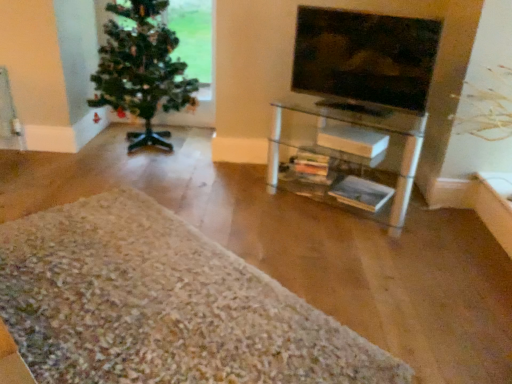
Question: Could you tell me if green matte christmas tree at left is facing matte glass tv at upper right?

Choices:
 (A) no
 (B) yes

Answer: (A)

Question: Is green matte christmas tree at left turned away from matte glass tv at upper right?

Choices:
 (A) yes
 (B) no

Answer: (B)

Question: From a real-world perspective, does green matte christmas tree at left stand above matte glass tv at upper right?

Choices:
 (A) no
 (B) yes

Answer: (A)

Question: Is green matte christmas tree at left smaller than matte glass tv at upper right?

Choices:
 (A) no
 (B) yes

Answer: (A)

Question: Is there a large distance between green matte christmas tree at left and matte glass tv at upper right?

Choices:
 (A) no
 (B) yes

Answer: (B)

Question: From the image's perspective, is white shaggy rug at lower left located above or below matte glass tv at upper right?

Choices:
 (A) above
 (B) below

Answer: (B)

Question: Is point (373, 354) closer or farther from the camera than point (426, 86)?

Choices:
 (A) closer
 (B) farther

Answer: (A)

Question: In terms of width, does white shaggy rug at lower left look wider or thinner when compared to matte glass tv at upper right?

Choices:
 (A) thin
 (B) wide

Answer: (B)

Question: In the image, is white shaggy rug at lower left positioned in front of or behind matte glass tv at upper right?

Choices:
 (A) front
 (B) behind

Answer: (A)

Question: Relative to clear glass shelf at center, is green matte christmas tree at left in front or behind?

Choices:
 (A) behind
 (B) front

Answer: (A)

Question: Based on their positions, is green matte christmas tree at left located to the left or right of clear glass shelf at center?

Choices:
 (A) left
 (B) right

Answer: (A)

Question: Considering the positions of point (138, 89) and point (297, 109), is point (138, 89) closer or farther from the camera than point (297, 109)?

Choices:
 (A) farther
 (B) closer

Answer: (A)

Question: Which is correct: green matte christmas tree at left is inside clear glass shelf at center, or outside of it?

Choices:
 (A) outside
 (B) inside

Answer: (A)

Question: Considering the positions of point (50, 365) and point (160, 87), is point (50, 365) closer or farther from the camera than point (160, 87)?

Choices:
 (A) closer
 (B) farther

Answer: (A)

Question: Considering the positions of white shaggy rug at lower left and green matte christmas tree at left in the image, is white shaggy rug at lower left wider or thinner than green matte christmas tree at left?

Choices:
 (A) wide
 (B) thin

Answer: (A)